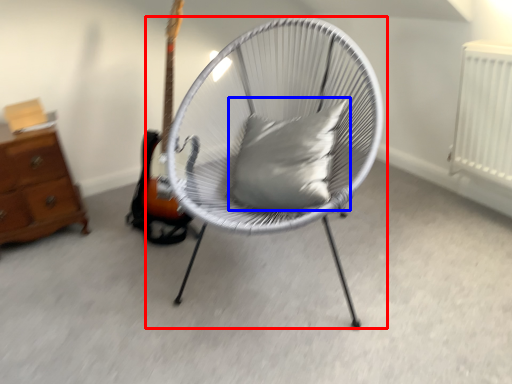
Question: Which object appears farthest to the camera in this image, chair (highlighted by a red box) or pillow (highlighted by a blue box)?

Choices:
 (A) chair
 (B) pillow

Answer: (B)